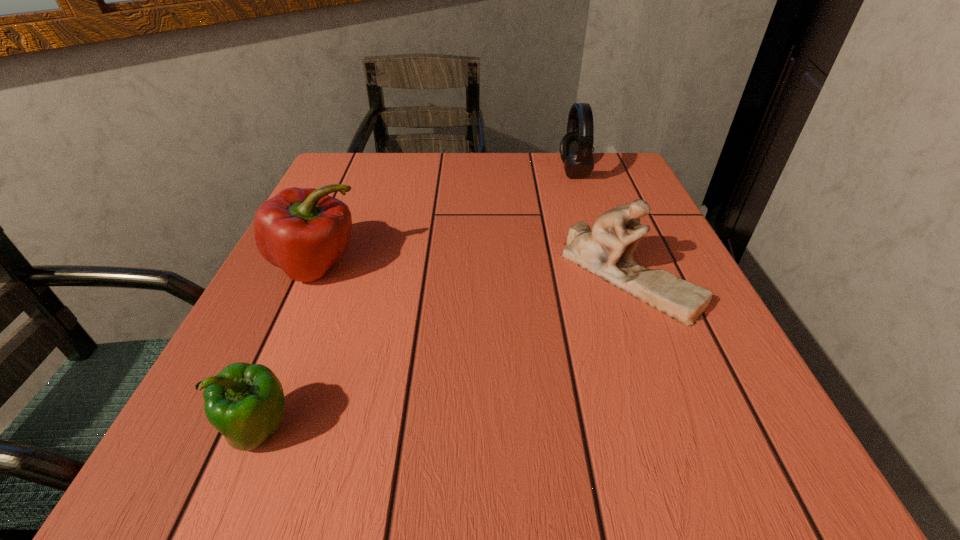
Identify which object is located as the second nearest to the farther bell pepper. Please provide its 2D coordinates. Your answer should be formatted as a tuple, i.e. [(x, y)], where the tuple contains the x and y coordinates of a point satisfying the conditions above.

[(606, 251)]

The height and width of the screenshot is (540, 960). In order to click on object that is the third closest to the figurine in this screenshot , I will do `click(245, 403)`.

You are a GUI agent. You are given a task and a screenshot of the screen. Output one action in this format:
    pyautogui.click(x=<x>, y=<y>)
    Task: Click on the free spot that satisfies the following two spatial constraints: 1. on the earcups of the farthest object; 2. on the front side of the farther bell pepper
    
    Given the screenshot: What is the action you would take?
    pyautogui.click(x=605, y=265)

Where is `vacant space that satisfies the following two spatial constraints: 1. on the earcups of the headset; 2. on the front side of the farther bell pepper`? vacant space that satisfies the following two spatial constraints: 1. on the earcups of the headset; 2. on the front side of the farther bell pepper is located at coordinates (605, 265).

I want to click on free space that satisfies the following two spatial constraints: 1. on the earcups of the farthest object; 2. on the front side of the shorter bell pepper, so click(660, 431).